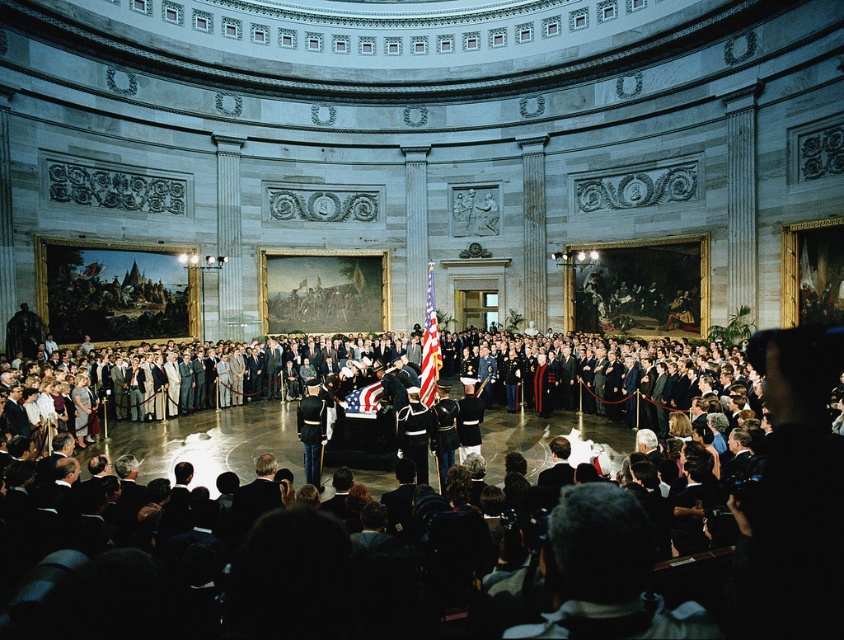
You are attending a formal event in a grand circular room. You see a dark suit crowd at center and an american flag at center. Which object takes up more space in the image?

The dark suit crowd at center has a larger size compared to the american flag at center, so the dark suit crowd at center takes up more space in the image.

You are standing at the entrance of the grand circular room and want to approach the dark suit crowd at center to offer condolences. The entrance is located at coordinates point 0.0. Which direction should you move in to reach them?

The dark suit crowd at center is located at point [388,570], so you should move towards the center of the room and then to the right to reach them.

You are attending a formal event in this room and want to take a photo of the matte american flag at center without the dark suit crowd at center blocking the view. Is the flag visible from your current position?

The dark suit crowd at center is closer to the viewer than the matte american flag at center, so the crowd may be blocking the view of the flag. Move to a position where you can see past the crowd to capture the flag without obstruction.